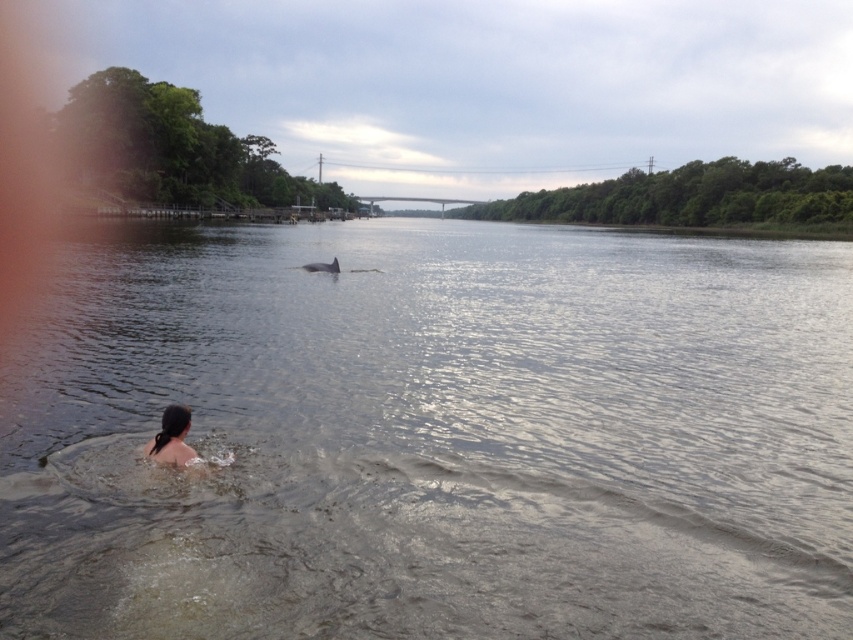
You are standing on the riverside and see the clear water at center and the dark hair at lower left. Which object is located above the other?

The clear water at center is positioned over dark hair at lower left, so the clear water at center is above the dark hair at lower left.

You are standing on the riverside and want to take a photo of both the clear water at center and the dark hair at lower left. Which object should you focus on first to ensure both are in the frame?

You should focus on the clear water at center first since it is closer to you than the dark hair at lower left, ensuring both are in the frame by adjusting the camera accordingly.